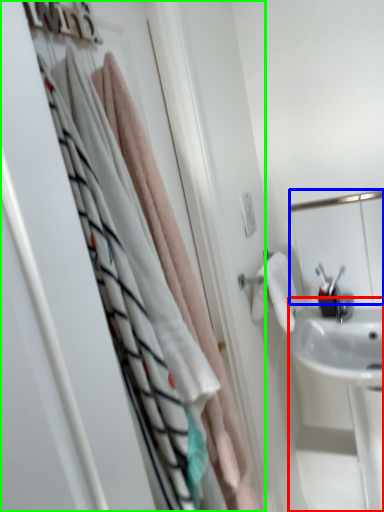
Question: Estimate the real-world distances between objects in this image. Which object is farther from sink (highlighted by a red box), mirror (highlighted by a blue box) or closet (highlighted by a green box)?

Choices:
 (A) mirror
 (B) closet

Answer: (B)